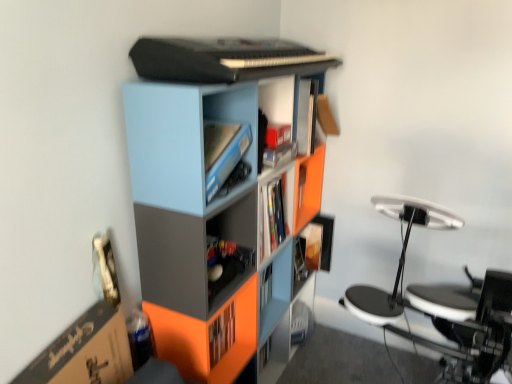
Question: Is matte black shelf at center directly adjacent to light blue plastic cabinet at upper center?

Choices:
 (A) no
 (B) yes

Answer: (A)

Question: Is there a large distance between matte black shelf at center and light blue plastic cabinet at upper center?

Choices:
 (A) yes
 (B) no

Answer: (B)

Question: Is matte black shelf at center facing away from light blue plastic cabinet at upper center?

Choices:
 (A) yes
 (B) no

Answer: (B)

Question: Can you confirm if matte black shelf at center is taller than light blue plastic cabinet at upper center?

Choices:
 (A) yes
 (B) no

Answer: (B)

Question: Considering the relative sizes of matte black shelf at center and light blue plastic cabinet at upper center in the image provided, is matte black shelf at center smaller than light blue plastic cabinet at upper center?

Choices:
 (A) yes
 (B) no

Answer: (A)

Question: Is matte black shelf at center taller or shorter than light blue plastic cabinet at upper center?

Choices:
 (A) tall
 (B) short

Answer: (B)

Question: Considering their positions, is matte black shelf at center located in front of or behind light blue plastic cabinet at upper center?

Choices:
 (A) behind
 (B) front

Answer: (A)

Question: Considering the positions of matte black shelf at center and light blue plastic cabinet at upper center in the image, is matte black shelf at center wider or thinner than light blue plastic cabinet at upper center?

Choices:
 (A) wide
 (B) thin

Answer: (B)

Question: Looking at the image, does matte black shelf at center seem bigger or smaller compared to light blue plastic cabinet at upper center?

Choices:
 (A) small
 (B) big

Answer: (A)

Question: Is light blue plastic cabinet at upper center bigger or smaller than matte black shelf at center?

Choices:
 (A) small
 (B) big

Answer: (B)

Question: Choose the correct answer: Is light blue plastic cabinet at upper center inside matte black shelf at center or outside it?

Choices:
 (A) outside
 (B) inside

Answer: (A)

Question: In the image, is light blue plastic cabinet at upper center on the left side or the right side of matte black shelf at center?

Choices:
 (A) left
 (B) right

Answer: (A)

Question: From a real-world perspective, is light blue plastic cabinet at upper center physically located above or below matte black shelf at center?

Choices:
 (A) above
 (B) below

Answer: (A)

Question: Is matte plastic bookcase at center taller or shorter than matte black shelf at center?

Choices:
 (A) tall
 (B) short

Answer: (A)

Question: Considering the positions of point (131, 160) and point (194, 314), is point (131, 160) closer or farther from the camera than point (194, 314)?

Choices:
 (A) farther
 (B) closer

Answer: (B)